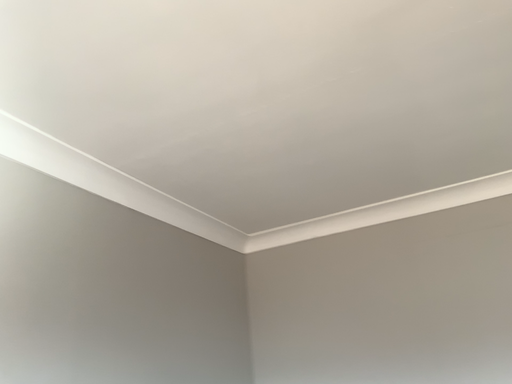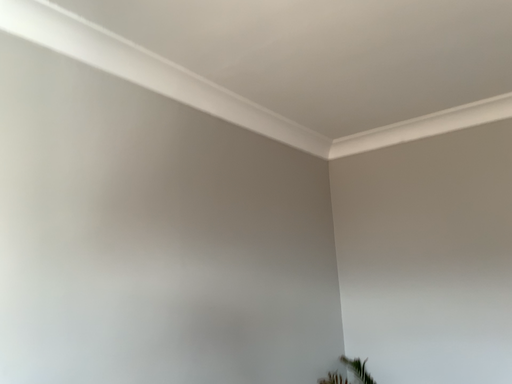
Question: Which way did the camera rotate in the video?

Choices:
 (A) rotated upward
 (B) rotated downward

Answer: (B)